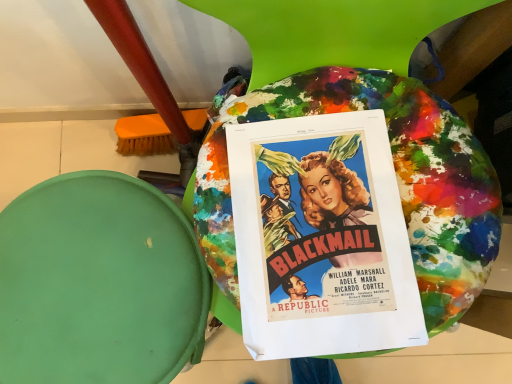
You are a GUI agent. You are given a task and a screenshot of the screen. Output one action in this format:
    pyautogui.click(x=<x>, y=<y>)
    Task: Click on the vacant point above paint splattered fabric bean bag at center (from a real-world perspective)
    The width and height of the screenshot is (512, 384).
    Given the screenshot: What is the action you would take?
    pyautogui.click(x=91, y=285)